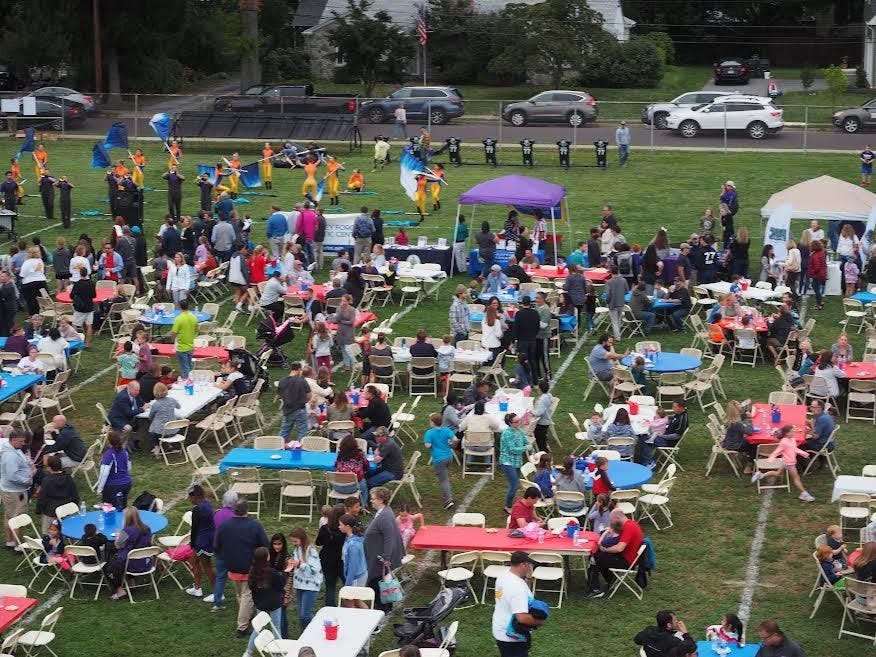
Locate an element on the screen. The height and width of the screenshot is (657, 876). 8 visibly round tables is located at coordinates (103, 292), (161, 317), (116, 512), (612, 474), (759, 320), (672, 357), (503, 294).